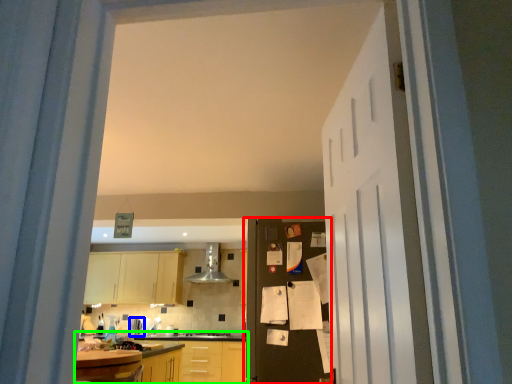
Question: Estimate the real-world distances between objects in this image. Which object is closer to door (highlighted by a red box), appliance (highlighted by a blue box) or countertop (highlighted by a green box)?

Choices:
 (A) appliance
 (B) countertop

Answer: (B)